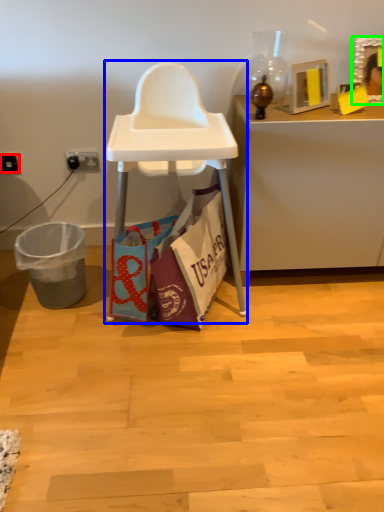
Question: Based on their relative distances, which object is farther from power outlet (highlighted by a red box)? Choose from armchair (highlighted by a blue box) and picture frame (highlighted by a green box).

Choices:
 (A) armchair
 (B) picture frame

Answer: (B)